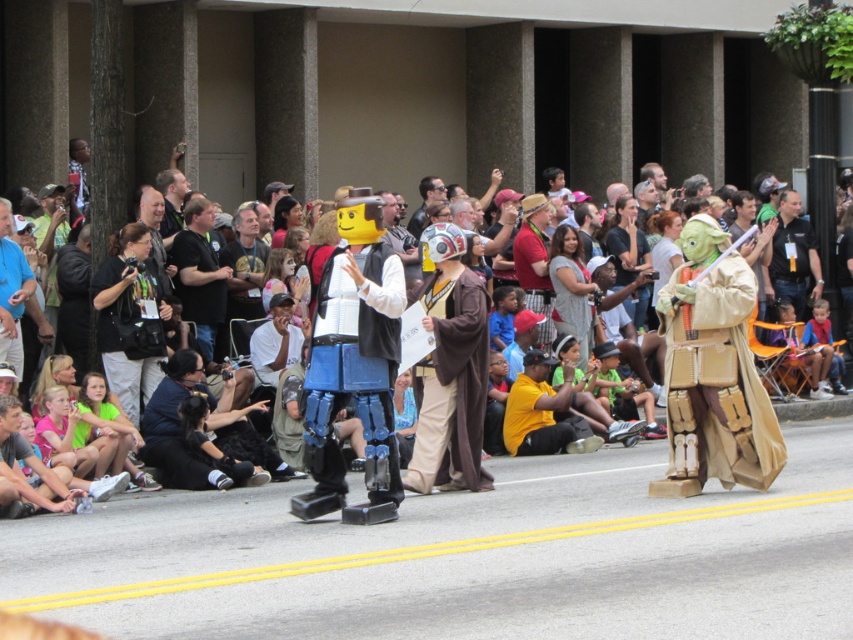
Question: Which of these objects is positioned closest to the matte yellow helmet at center?

Choices:
 (A) dark blue shirt at center
 (B) blue plastic robot at center

Answer: (A)

Question: Considering the relative positions of blue plastic robot at center and dark blue shirt at center in the image provided, where is blue plastic robot at center located with respect to dark blue shirt at center?

Choices:
 (A) below
 (B) above

Answer: (A)

Question: Which point appears farthest from the camera in this image?

Choices:
 (A) (x=778, y=317)
 (B) (x=194, y=225)

Answer: (A)

Question: Is black shirt at center behind light brown wooden chair at lower center?

Choices:
 (A) yes
 (B) no

Answer: (B)

Question: Does black shirt at center appear on the left side of dark blue shirt at center?

Choices:
 (A) yes
 (B) no

Answer: (A)

Question: Which object appears farthest from the camera in this image?

Choices:
 (A) light brown wooden chair at lower center
 (B) black fabric camera at center
 (C) black shirt at center
 (D) matte yellow helmet at center

Answer: (A)